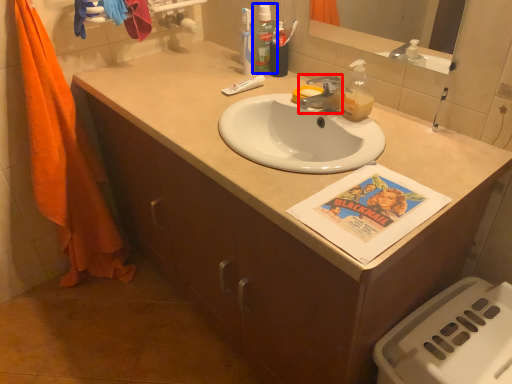
Question: Which of the following is the farthest to the observer, faucet (highlighted by a red box) or mouthwash (highlighted by a blue box)?

Choices:
 (A) faucet
 (B) mouthwash

Answer: (B)